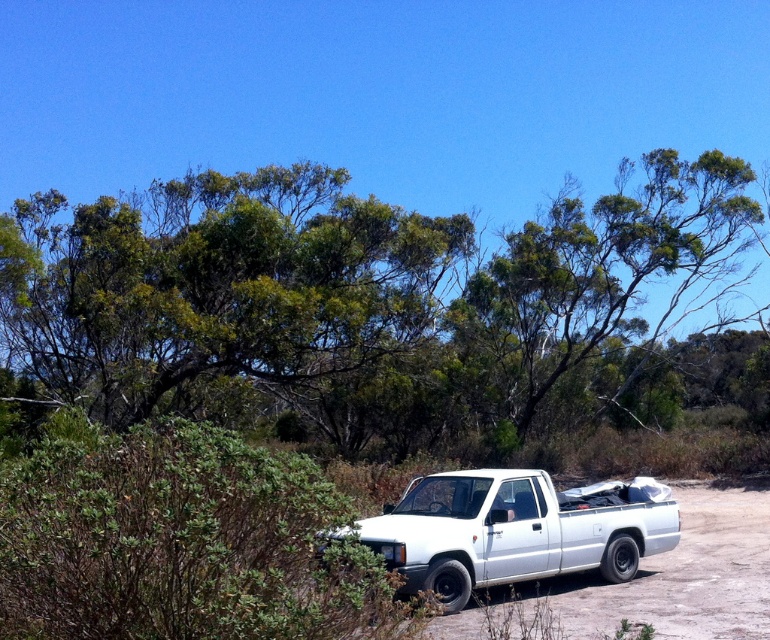
You are a photographer planning to take a picture of the white matte pickup truck at center. You want to ensure the green leafy tree at upper center doesn not block the truck in the photo. Based on their sizes, is this possible?

The green leafy tree at upper center is taller than the white matte pickup truck at center, so it might block the truck if positioned directly in front. To avoid obstruction, position the camera at an angle where the tree is not directly overlapping the truck.

You are planning to take a photo of the white matte pickup truck at center from the green leafy tree at upper center. Considering the size of both objects, will the tree block the entire truck in your photo?

The green leafy tree at upper center is bigger than the white matte pickup truck at center, so it could potentially block part of the truck depending on the angle and distance, but not necessarily the entire truck since the tree is larger but positioned at a different height.